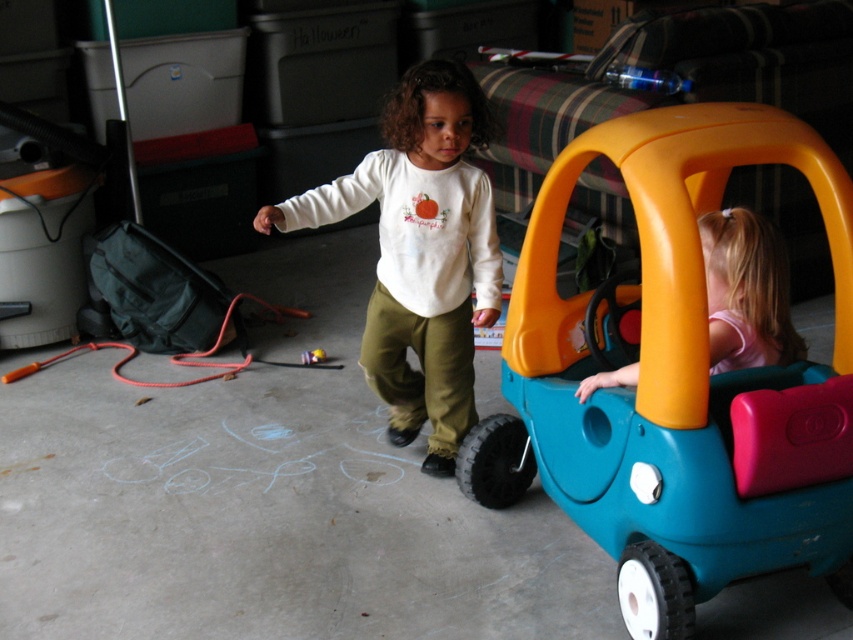
You are a parent trying to find your child who is wearing a white cotton shirt. You see the white cotton shirt at center and the smooth plastic toy car at center in the garage. Which object is taller and could help you locate your child?

The white cotton shirt at center is taller than the smooth plastic toy car at center, so the white cotton shirt at center is the one your child is wearing and can help you locate them.

You are trying to decide if the blue plastic toy car at center can fit through a doorway that is the same width as the white cotton shirt at center. Based on the scene, can it fit?

The blue plastic toy car at center might be wider than the white cotton shirt at center, so it may not fit through the doorway.

You are a parent trying to locate your child who is wearing a white cotton shirt. You see the smooth plastic toy car at center. Is the white cotton shirt at center visible from the toy car?

The white cotton shirt at center is in front of the smooth plastic toy car at center, so yes, the white cotton shirt at center is visible from the toy car.